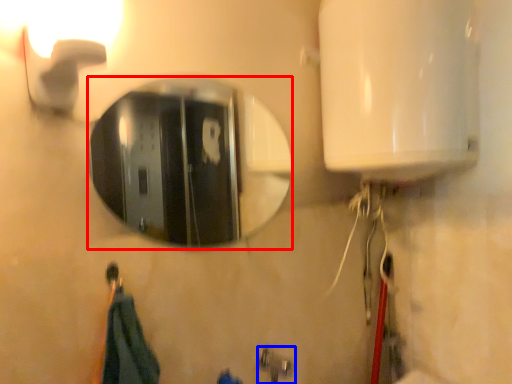
Question: Which object is closer to the camera taking this photo, mirror (highlighted by a red box) or plumbing fixture (highlighted by a blue box)?

Choices:
 (A) mirror
 (B) plumbing fixture

Answer: (A)